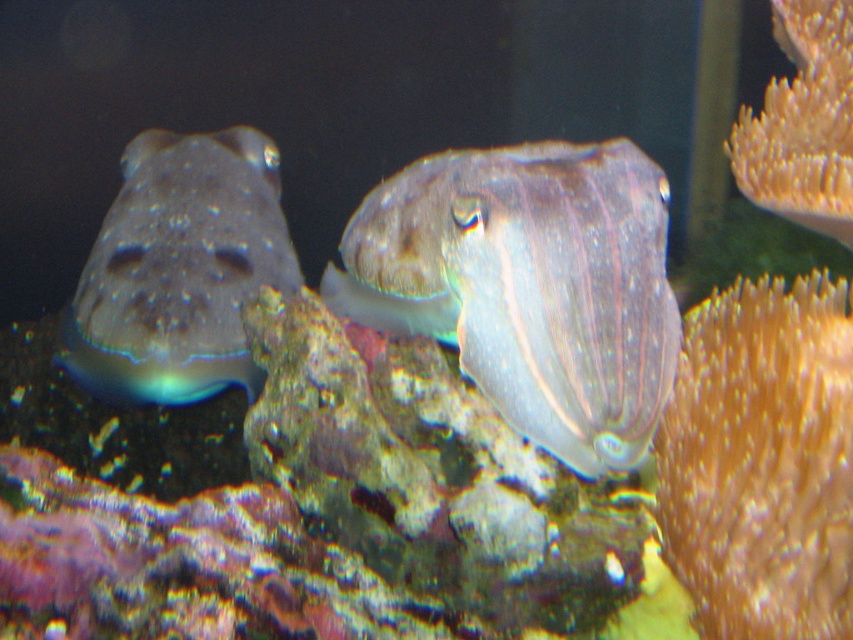
You are standing in front of an aquarium and see the translucent rubber squid at center. If you want to touch it, will your hand reach it if you extend your arm fully? Assume your arm can extend 3.5 feet.

The translucent rubber squid at center is 4.05 feet away from the viewer. Since your arm can only extend 3.5 feet, you cannot reach it.

You are an underwater explorer who wants to collect the translucent rubber squid at center and the orange soft coral at right. According to the image, which one is located to the left of the other?

The translucent rubber squid at center is positioned on the left side of orange soft coral at right.